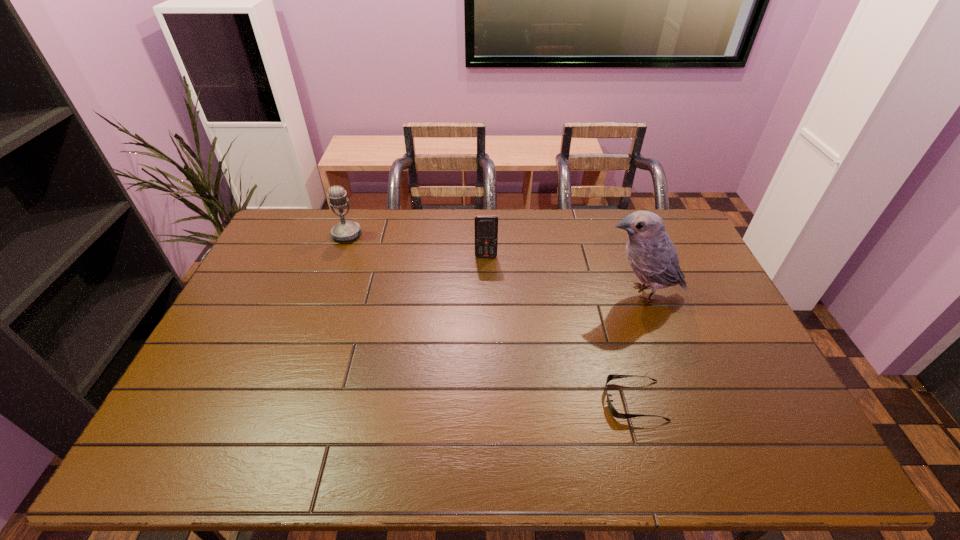
Where is `the second nearest object`? This screenshot has height=540, width=960. the second nearest object is located at coordinates (653, 257).

Locate an element on the screen. This screenshot has width=960, height=540. parrot is located at coordinates (653, 257).

I want to click on the leftmost object, so click(x=345, y=230).

Locate an element on the screen. The image size is (960, 540). microphone is located at coordinates (345, 230).

The image size is (960, 540). What are the coordinates of `cellular telephone` in the screenshot? It's located at (486, 226).

The height and width of the screenshot is (540, 960). In order to click on the third tallest object in this screenshot , I will do [486, 226].

Where is `sunglasses`? This screenshot has height=540, width=960. sunglasses is located at coordinates (610, 377).

I want to click on the nearest object, so click(x=610, y=377).

I want to click on vacant space located on the front-facing side of the third farthest object, so click(520, 294).

I want to click on vacant region located 0.200m on the front-facing side of the third farthest object, so click(536, 294).